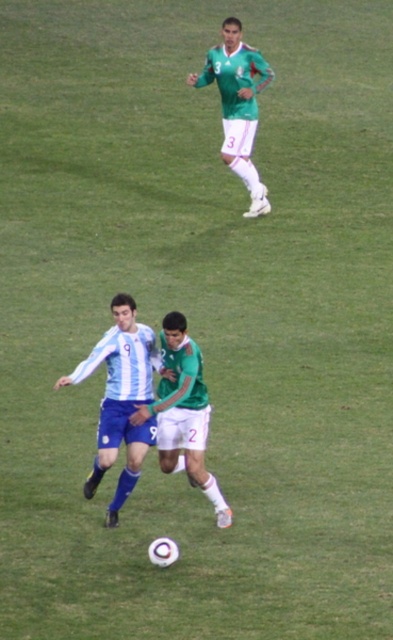
Who is taller, blue jersey at center or green matte jersey at center?

With more height is blue jersey at center.

Does blue jersey at center appear over green matte jersey at center?

Yes, blue jersey at center is above green matte jersey at center.

Is point (137, 356) in front of point (198, 381)?

That is False.

Find the location of `blue jersey at center`. blue jersey at center is located at coordinates (121, 397).

Is green matte jersey at center above green matte jersey at upper center?

Actually, green matte jersey at center is below green matte jersey at upper center.

Describe the element at coordinates (183, 412) in the screenshot. I see `green matte jersey at center` at that location.

Between point (172, 456) and point (216, 60), which one is positioned in front?

Point (172, 456)

I want to click on green matte jersey at center, so click(x=183, y=412).

Can you confirm if blue jersey at center is taller than green matte jersey at upper center?

Incorrect, blue jersey at center's height is not larger of green matte jersey at upper center's.

Between blue jersey at center and green matte jersey at upper center, which one appears on the left side from the viewer's perspective?

From the viewer's perspective, blue jersey at center appears more on the left side.

Identify the location of blue jersey at center. (121, 397).